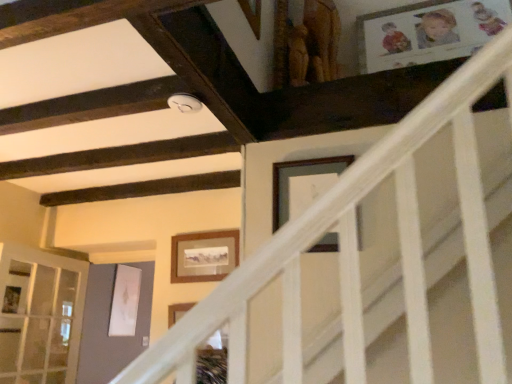
Image resolution: width=512 pixels, height=384 pixels. What are the coordinates of `clear glass door at lower left` in the screenshot? It's located at (40, 315).

The width and height of the screenshot is (512, 384). In order to click on wooden picture frame at upper center, which is the 1th picture frame in front-to-back order in this screenshot , I will do 303,184.

The height and width of the screenshot is (384, 512). In order to click on clear glass door at lower left in this screenshot , I will do `click(40, 315)`.

Between clear glass door at lower left and wooden picture frame at upper center, the 1th picture frame positioned from the right, which one has smaller size?

wooden picture frame at upper center, the 1th picture frame positioned from the right.

Does clear glass door at lower left come behind wooden picture frame at upper center, which ranks as the 2th picture frame in bottom-to-top order?

Yes, it is.

From the image's perspective, which is above, clear glass door at lower left or wooden picture frame at upper center, placed as the first picture frame when sorted from top to bottom?

From the image's view, wooden picture frame at upper center, placed as the first picture frame when sorted from top to bottom, is above.

You are a GUI agent. You are given a task and a screenshot of the screen. Output one action in this format:
    pyautogui.click(x=<x>, y=<y>)
    Task: Click on the glass door below the wooden picture frame at upper center, the 1th picture frame positioned from the right (from a real-world perspective)
    
    Given the screenshot: What is the action you would take?
    pyautogui.click(x=40, y=315)

Is wooden picture frame at upper center, which is the second picture frame from left to right, facing away from clear glass door at lower left?

No.

Does point (281, 189) come closer to viewer compared to point (65, 295)?

Yes, point (281, 189) is closer to viewer.

Considering the sizes of wooden picture frame at upper center, which is the 1th picture frame in front-to-back order, and clear glass door at lower left in the image, is wooden picture frame at upper center, which is the 1th picture frame in front-to-back order, bigger or smaller than clear glass door at lower left?

wooden picture frame at upper center, which is the 1th picture frame in front-to-back order, is smaller than clear glass door at lower left.

Identify the location of glass door below the wooden picture frame at upper center, which is the second picture frame from left to right (from the image's perspective). (40, 315).

In terms of width, does wooden picture frame at upper center, which ranks as the second picture frame in back-to-front order, look wider or thinner when compared to wooden framed picture at center, which appears as the second picture frame when viewed from the right?

A: Clearly, wooden picture frame at upper center, which ranks as the second picture frame in back-to-front order, has less width compared to wooden framed picture at center, which appears as the second picture frame when viewed from the right.

Based on the photo, from a real-world perspective, is wooden picture frame at upper center, which ranks as the 2th picture frame in bottom-to-top order, physically located above or below wooden framed picture at center, which ranks as the 1th picture frame in back-to-front order?

wooden picture frame at upper center, which ranks as the 2th picture frame in bottom-to-top order, is situated higher than wooden framed picture at center, which ranks as the 1th picture frame in back-to-front order, in the real world.

Is wooden picture frame at upper center, placed as the first picture frame when sorted from top to bottom, oriented towards wooden framed picture at center, the 2th picture frame viewed from the front?

No, wooden picture frame at upper center, placed as the first picture frame when sorted from top to bottom, does not turn towards wooden framed picture at center, the 2th picture frame viewed from the front.

Would you say clear glass door at lower left is inside or outside wooden framed picture at center, the 2th picture frame viewed from the front?

clear glass door at lower left cannot be found inside wooden framed picture at center, the 2th picture frame viewed from the front.

Who is more distant, clear glass door at lower left or wooden framed picture at center, which appears as the second picture frame when viewed from the right?

wooden framed picture at center, which appears as the second picture frame when viewed from the right, is more distant.

Is clear glass door at lower left with wooden framed picture at center, which ranks as the 1th picture frame in back-to-front order?

clear glass door at lower left is not next to wooden framed picture at center, which ranks as the 1th picture frame in back-to-front order, and they're not touching.

Is wooden framed picture at center, the 2th picture frame viewed from the front, completely or partially outside of clear glass door at lower left?

Absolutely, wooden framed picture at center, the 2th picture frame viewed from the front, is external to clear glass door at lower left.

Is wooden framed picture at center, the 1th picture frame in the left-to-right sequence, positioned far away from clear glass door at lower left?

wooden framed picture at center, the 1th picture frame in the left-to-right sequence, is far away from clear glass door at lower left.

Is wooden framed picture at center, which ranks as the 1th picture frame in back-to-front order, oriented towards clear glass door at lower left?

No, wooden framed picture at center, which ranks as the 1th picture frame in back-to-front order, is not turned towards clear glass door at lower left.

From a real-world perspective, is wooden framed picture at center, the 1th picture frame from the bottom, positioned over wooden picture frame at upper center, which is the second picture frame from left to right, based on gravity?

Actually, wooden framed picture at center, the 1th picture frame from the bottom, is physically below wooden picture frame at upper center, which is the second picture frame from left to right, in the real world.

Which of these two, wooden framed picture at center, which ranks as the 1th picture frame in back-to-front order, or wooden picture frame at upper center, which ranks as the 2th picture frame in bottom-to-top order, stands shorter?

With less height is wooden framed picture at center, which ranks as the 1th picture frame in back-to-front order.

Is wooden framed picture at center, which ranks as the 1th picture frame in back-to-front order, not near wooden picture frame at upper center, which ranks as the 2th picture frame in bottom-to-top order?

wooden framed picture at center, which ranks as the 1th picture frame in back-to-front order, is actually quite close to wooden picture frame at upper center, which ranks as the 2th picture frame in bottom-to-top order.

Does wooden framed picture at center, the 2th picture frame viewed from the front, have a lesser width compared to wooden picture frame at upper center, which is the 1th picture frame in front-to-back order?

No, wooden framed picture at center, the 2th picture frame viewed from the front, is not thinner than wooden picture frame at upper center, which is the 1th picture frame in front-to-back order.

Find the location of `glass door lying behind the wooden picture frame at upper center, which ranks as the 2th picture frame in bottom-to-top order`. glass door lying behind the wooden picture frame at upper center, which ranks as the 2th picture frame in bottom-to-top order is located at coordinates (40, 315).

This screenshot has width=512, height=384. Find the location of `the 2nd picture frame above the clear glass door at lower left (from a real-world perspective)`. the 2nd picture frame above the clear glass door at lower left (from a real-world perspective) is located at coordinates (303, 184).

When comparing their distances from wooden picture frame at upper center, which is the second picture frame from left to right, does wooden framed picture at center, the 2th picture frame viewed from the front, or clear glass door at lower left seem further?

The object further to wooden picture frame at upper center, which is the second picture frame from left to right, is clear glass door at lower left.

Considering their positions, is wooden picture frame at upper center, placed as the first picture frame when sorted from top to bottom, positioned closer to wooden framed picture at center, the 1th picture frame from the bottom, than clear glass door at lower left?

wooden picture frame at upper center, placed as the first picture frame when sorted from top to bottom, is closer to wooden framed picture at center, the 1th picture frame from the bottom.

When comparing their distances from wooden picture frame at upper center, which is the second picture frame from left to right, does clear glass door at lower left or wooden framed picture at center, arranged as the second picture frame when viewed from the top, seem further?

The object further to wooden picture frame at upper center, which is the second picture frame from left to right, is clear glass door at lower left.

Looking at the image, which one is located closer to clear glass door at lower left, wooden picture frame at upper center, which is the second picture frame from left to right, or wooden framed picture at center, the 1th picture frame from the bottom?

The object closer to clear glass door at lower left is wooden framed picture at center, the 1th picture frame from the bottom.

Estimate the real-world distances between objects in this image. Which object is further from wooden framed picture at center, which ranks as the 1th picture frame in back-to-front order, clear glass door at lower left or wooden picture frame at upper center, the 1th picture frame positioned from the right?

The object further to wooden framed picture at center, which ranks as the 1th picture frame in back-to-front order, is clear glass door at lower left.

Looking at this image, which object lies nearer to the anchor point clear glass door at lower left, wooden framed picture at center, which ranks as the 1th picture frame in back-to-front order, or wooden picture frame at upper center, which ranks as the 2th picture frame in bottom-to-top order?

The object closer to clear glass door at lower left is wooden framed picture at center, which ranks as the 1th picture frame in back-to-front order.

Locate an element on the screen. The image size is (512, 384). picture frame between clear glass door at lower left and wooden picture frame at upper center, which ranks as the 2th picture frame in bottom-to-top order, from left to right is located at coordinates (204, 256).